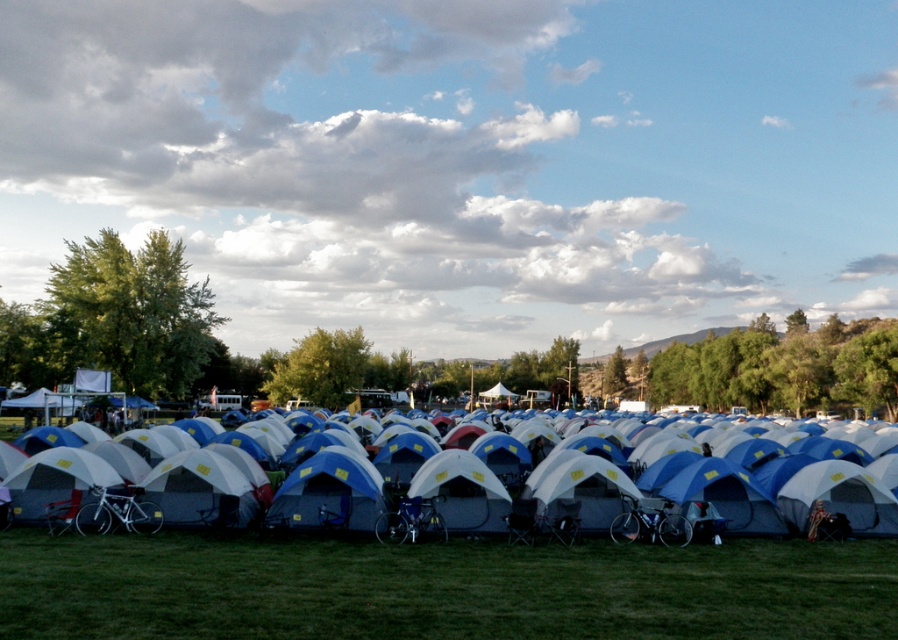
Is green grass at lower center positioned in front of white fabric tent at center?

Yes.

Looking at this image, between green grass at lower center and white fabric tent at center, which one appears on the right side from the viewer's perspective?

Positioned to the right is white fabric tent at center.

Describe the element at coordinates (439, 588) in the screenshot. I see `green grass at lower center` at that location.

I want to click on green grass at lower center, so click(x=439, y=588).